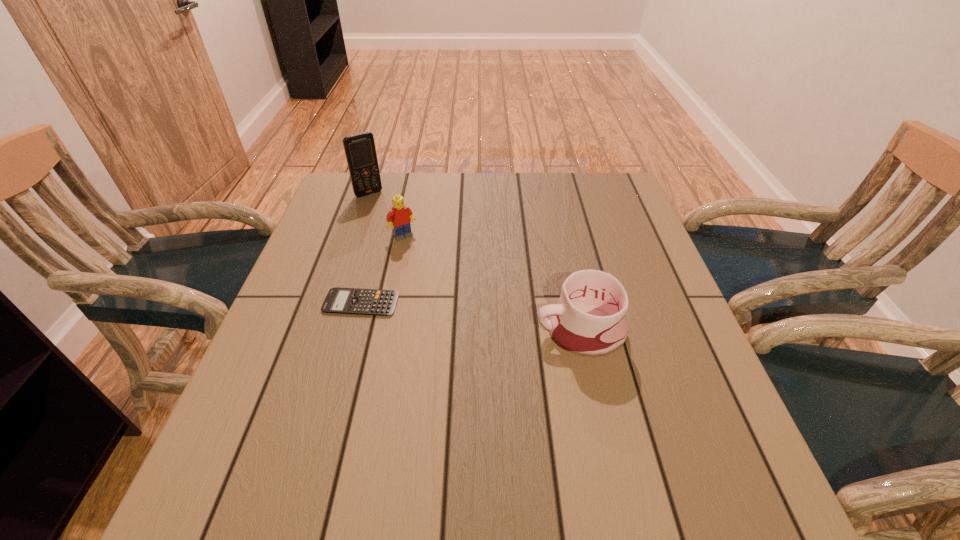
Image resolution: width=960 pixels, height=540 pixels. What are the coordinates of `vacant area that lies between the calculator and the third nearest object` in the screenshot? It's located at (382, 269).

Locate an element on the screen. vacant point located between the shortest object and the Lego is located at coordinates (382, 269).

Locate an element on the screen. The height and width of the screenshot is (540, 960). unoccupied area between the second farthest object and the rightmost object is located at coordinates (492, 284).

Where is `free space between the shortest object and the third nearest object`? Image resolution: width=960 pixels, height=540 pixels. free space between the shortest object and the third nearest object is located at coordinates (382, 269).

In order to click on vacant area that lies between the farthest object and the mug in this screenshot , I will do `click(474, 262)`.

The width and height of the screenshot is (960, 540). I want to click on vacant area that lies between the cellular telephone and the third nearest object, so click(x=386, y=215).

Where is `object that ranks as the third closest to the mug`? The image size is (960, 540). object that ranks as the third closest to the mug is located at coordinates (360, 151).

Where is `object that is the third nearest to the rightmost object`? This screenshot has height=540, width=960. object that is the third nearest to the rightmost object is located at coordinates (360, 151).

Find the location of `free space that satisfies the following two spatial constraints: 1. on the back side of the Lego; 2. on the right side of the shortest object`. free space that satisfies the following two spatial constraints: 1. on the back side of the Lego; 2. on the right side of the shortest object is located at coordinates (379, 236).

In order to click on free point that satisfies the following two spatial constraints: 1. on the front side of the calculator; 2. on the right side of the cellular telephone in this screenshot , I will do `click(332, 303)`.